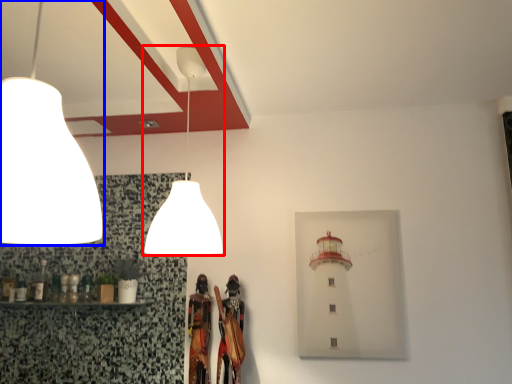
Question: Among these objects, which one is farthest to the camera, lamp (highlighted by a red box) or lamp (highlighted by a blue box)?

Choices:
 (A) lamp
 (B) lamp

Answer: (A)